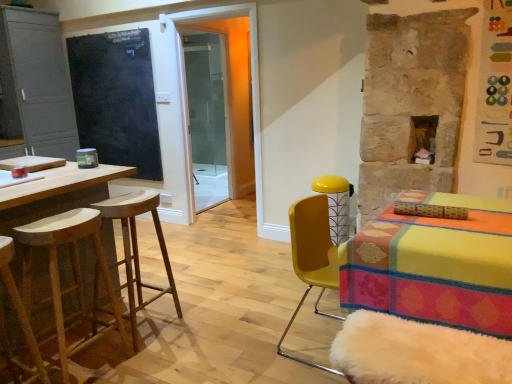
Locate an element on the screen. vacant area that is in front of wooden bar stool at left, placed as the 3th stool when sorted from front to back is located at coordinates (154, 360).